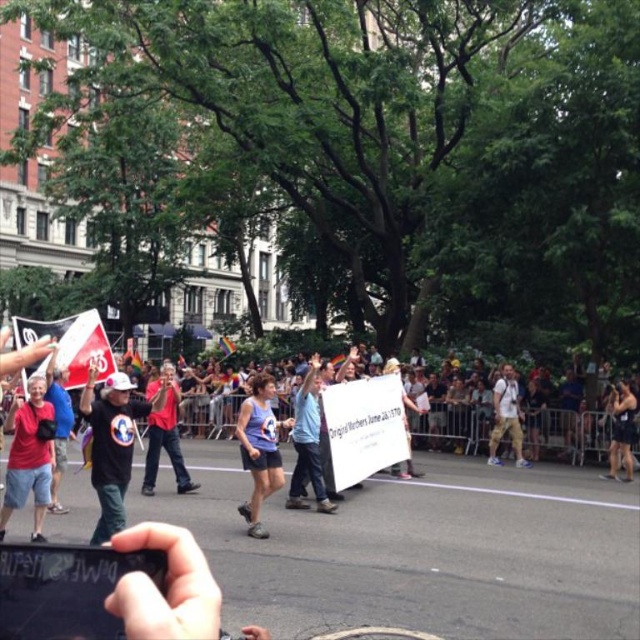
You are a photographer at the parade and want to capture a photo of the red cotton tank top at center and the skinny jeans at center. Which clothing item should you focus on first if you want to capture them in order from top to bottom?

The skinny jeans at center should be focused on first from the top since the red cotton tank top at center is located below skinny jeans at center.

In the image of the vibrant street scene, there is a person wearing a red cotton tank top at center. If you were standing at the point marked by coordinates point (164,435), which object would you be standing on?

The coordinates point (164,435) correspond to the red cotton tank top at center, so you would be standing on the red cotton tank top at center.